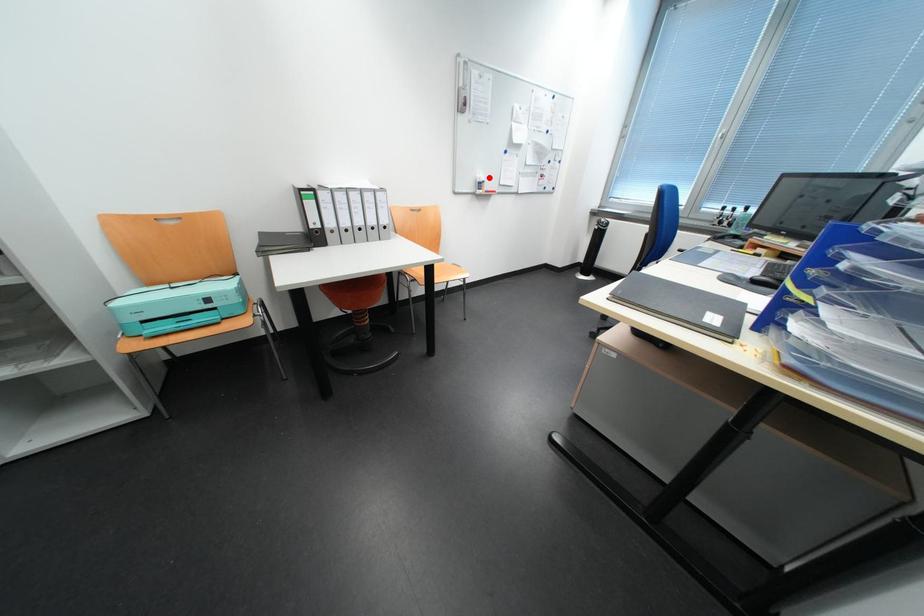
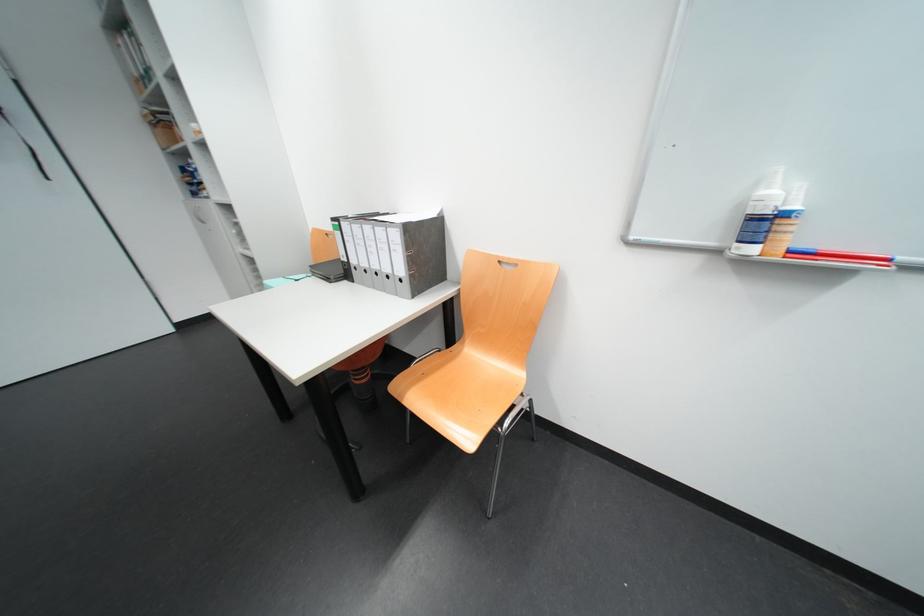
Question: I am providing you with two images of the same scene from different viewpoints. A red point is shown in image1. For the corresponding object point in image2, is it positioned nearer or farther from the camera?

Choices:
 (A) Nearer
 (B) Farther

Answer: (B)